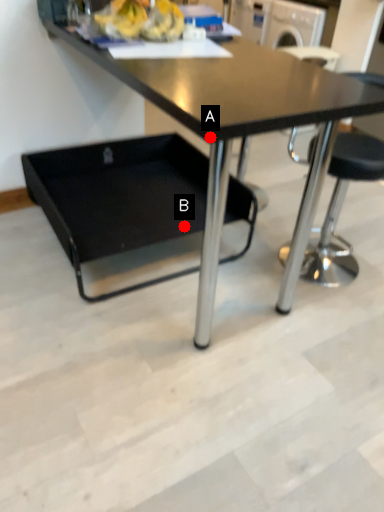
Question: Two points are circled on the image, labeled by A and B beside each circle. Which point is closer to the camera?

Choices:
 (A) A is closer
 (B) B is closer

Answer: (A)